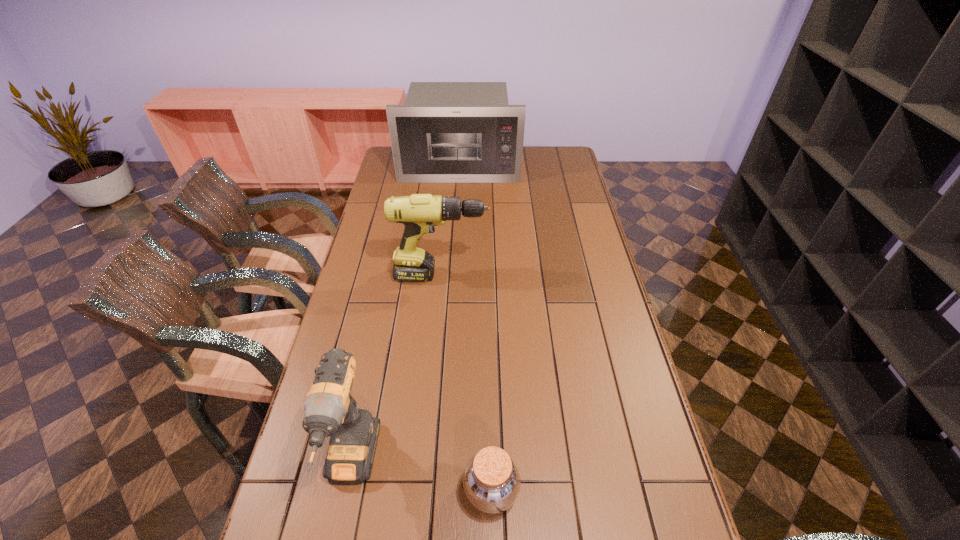
Locate an element on the screen. The width and height of the screenshot is (960, 540). vacant space that satisfies the following two spatial constraints: 1. on the front-facing side of the farthest object; 2. on the right side of the jar is located at coordinates (439, 491).

Locate an element on the screen. The image size is (960, 540). vacant region that satisfies the following two spatial constraints: 1. with the drill bit of the nearer drill facing forward; 2. on the right side of the jar is located at coordinates (346, 491).

I want to click on vacant space that satisfies the following two spatial constraints: 1. on the front-facing side of the microwave oven; 2. on the left side of the jar, so click(x=439, y=491).

The height and width of the screenshot is (540, 960). What are the coordinates of `vacant space that satisfies the following two spatial constraints: 1. on the handle side of the shortest object; 2. on the left side of the farther drill` in the screenshot? It's located at (422, 491).

Identify the location of free location that satisfies the following two spatial constraints: 1. on the handle side of the second farthest object; 2. with the drill bit of the nearer drill facing forward. (424, 466).

The width and height of the screenshot is (960, 540). I want to click on free spot that satisfies the following two spatial constraints: 1. with the drill bit of the nearer drill facing forward; 2. on the left side of the shortest object, so click(x=346, y=491).

You are a GUI agent. You are given a task and a screenshot of the screen. Output one action in this format:
    pyautogui.click(x=<x>, y=<y>)
    Task: Click on the free region that satisfies the following two spatial constraints: 1. on the back side of the jar; 2. on the handle side of the second farthest object
    
    Given the screenshot: What is the action you would take?
    pyautogui.click(x=488, y=275)